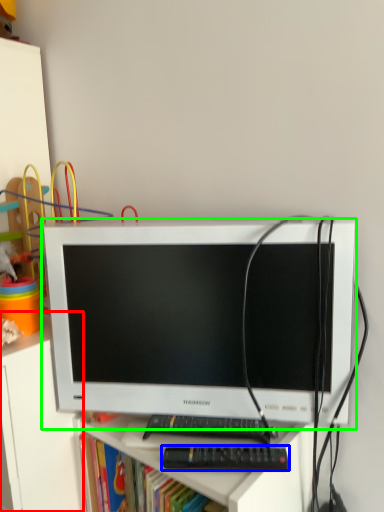
Question: Which object is the closest to the file cabinet (highlighted by a red box)? Choose among these: control (highlighted by a blue box) or computer monitor (highlighted by a green box).

Choices:
 (A) control
 (B) computer monitor

Answer: (B)